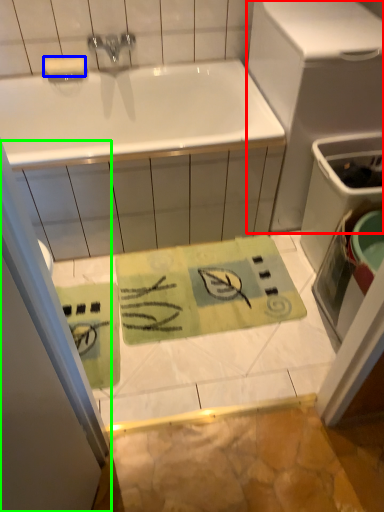
Question: Based on their relative distances, which object is farther from appliance (highlighted by a red box)? Choose from soap (highlighted by a blue box) and shower door (highlighted by a green box).

Choices:
 (A) soap
 (B) shower door

Answer: (B)